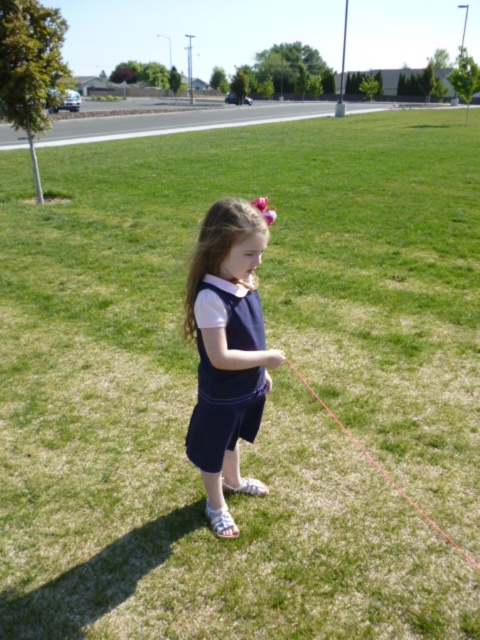
Is matte navy dress at center above red string at lower center?

Correct, matte navy dress at center is located above red string at lower center.

Who is positioned more to the left, matte navy dress at center or red string at lower center?

matte navy dress at center

Between point (240, 403) and point (298, 372), which one is positioned behind?

Positioned behind is point (298, 372).

At what (x,y) coordinates should I click in order to perform the action: click on matte navy dress at center. Please return your answer as a coordinate pair (x, y). The height and width of the screenshot is (640, 480). Looking at the image, I should click on (228, 349).

Between point (214, 429) and point (212, 365), which one is positioned in front?

Positioned in front is point (212, 365).

Who is positioned more to the left, matte navy dress at center or navy matte dress at center?

matte navy dress at center is more to the left.

Is point (249, 429) positioned before point (220, 378)?

No.

This screenshot has height=640, width=480. Find the location of `matte navy dress at center`. matte navy dress at center is located at coordinates (228, 349).

Does point (203, 413) lie in front of point (469, 556)?

No.

Does navy matte dress at center have a smaller size compared to red string at lower center?

Yes.

Is point (207, 428) positioned before point (342, 426)?

Yes, point (207, 428) is closer to viewer.

Locate an element on the screen. The height and width of the screenshot is (640, 480). navy matte dress at center is located at coordinates (223, 410).